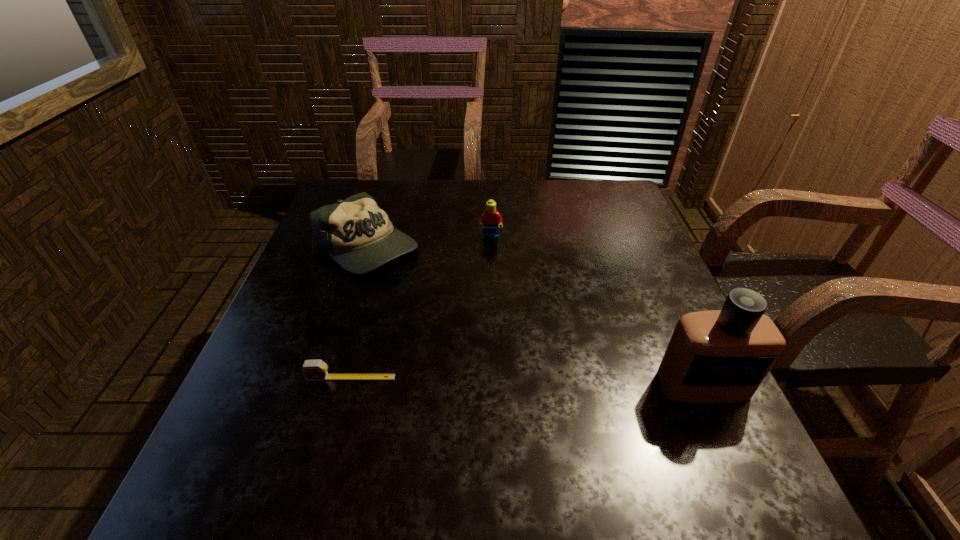
Identify the location of the shortest object. The image size is (960, 540). (313, 370).

The width and height of the screenshot is (960, 540). What are the coordinates of `the tallest object` in the screenshot? It's located at (715, 356).

Image resolution: width=960 pixels, height=540 pixels. I want to click on the rightmost object, so click(x=715, y=356).

Locate an element on the screen. the third object from left to right is located at coordinates (490, 219).

At what (x,y) coordinates should I click in order to perform the action: click on baseball cap. Please return your answer as a coordinate pair (x, y). The height and width of the screenshot is (540, 960). Looking at the image, I should click on (x=356, y=233).

Locate an element on the screen. free space located 0.110m at the front of the shortest object with the tape extended is located at coordinates (336, 435).

Where is `vacant space located 0.070m on the front label of the tallest object`? The width and height of the screenshot is (960, 540). vacant space located 0.070m on the front label of the tallest object is located at coordinates (728, 440).

Where is `free space located on the face of the Lego`? free space located on the face of the Lego is located at coordinates (496, 338).

The width and height of the screenshot is (960, 540). Identify the location of free space located 0.070m on the face of the Lego. (492, 258).

Locate an element on the screen. Image resolution: width=960 pixels, height=540 pixels. blank area located 0.080m on the face of the Lego is located at coordinates (492, 260).